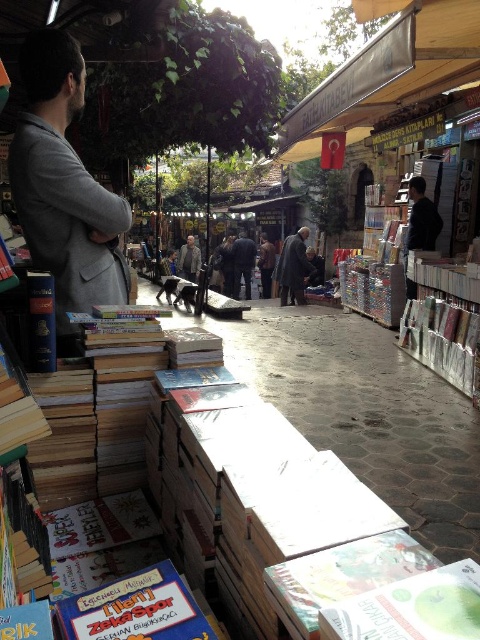
Is green matte book at center thinner than dark blue suit at center?

Correct, green matte book at center's width is less than dark blue suit at center's.

Measure the distance between green matte book at center and camera.

The distance of green matte book at center from camera is 24.90 inches.

The height and width of the screenshot is (640, 480). I want to click on green matte book at center, so click(x=411, y=608).

Identify the location of green matte book at center. This screenshot has height=640, width=480. (411, 608).

Does hardcover book at lower left appear under dark blue suit at center?

Yes, hardcover book at lower left is below dark blue suit at center.

Between hardcover book at lower left and dark blue suit at center, which one has more height?

dark blue suit at center

Find the location of a particular element. This screenshot has width=480, height=640. hardcover book at lower left is located at coordinates (135, 609).

Measure the distance between dark blue suit at center and dark gray jacket at center.

dark blue suit at center is 2.48 meters from dark gray jacket at center.

Identify the location of dark blue suit at center. The height and width of the screenshot is (640, 480). (241, 262).